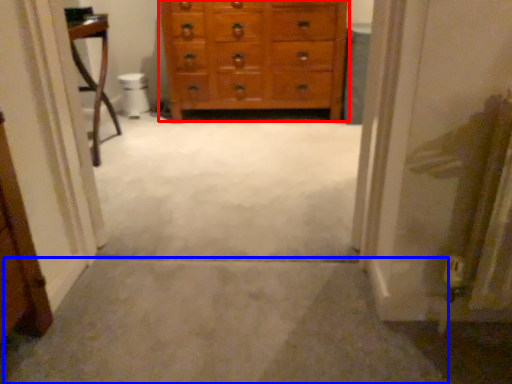
Question: Which point is further to the camera, chest of drawers (highlighted by a red box) or path (highlighted by a blue box)?

Choices:
 (A) chest of drawers
 (B) path

Answer: (A)